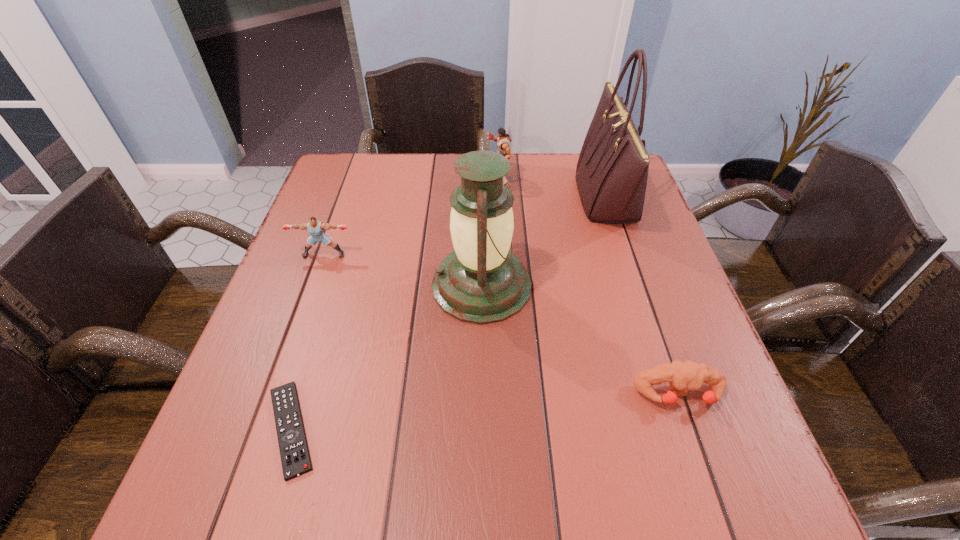
Identify the location of free space at the far edge of the desktop. (526, 176).

Where is `free region at the near edge`? This screenshot has height=540, width=960. free region at the near edge is located at coordinates (328, 496).

Where is `vacant point at the right edge`? Image resolution: width=960 pixels, height=540 pixels. vacant point at the right edge is located at coordinates (651, 271).

This screenshot has width=960, height=540. Identify the location of vacant area between the handbag and the rightmost puncher. (643, 296).

The image size is (960, 540). Identify the location of vacant space that is in between the lantern and the remote control. [x=386, y=357].

At what (x,y) coordinates should I click in order to perform the action: click on empty location between the lantern and the fourth tallest object. Please return your answer as a coordinate pair (x, y). Looking at the image, I should click on (403, 269).

Where is `free space between the tallest puncher and the leftmost puncher`? This screenshot has width=960, height=540. free space between the tallest puncher and the leftmost puncher is located at coordinates (411, 217).

The image size is (960, 540). I want to click on free point between the lantern and the remote control, so [x=386, y=357].

The width and height of the screenshot is (960, 540). In order to click on the fourth closest object to the farthest puncher in this screenshot , I will do `click(683, 376)`.

Image resolution: width=960 pixels, height=540 pixels. In order to click on object that stands as the fifth closest to the shortest puncher in this screenshot , I will do `click(315, 228)`.